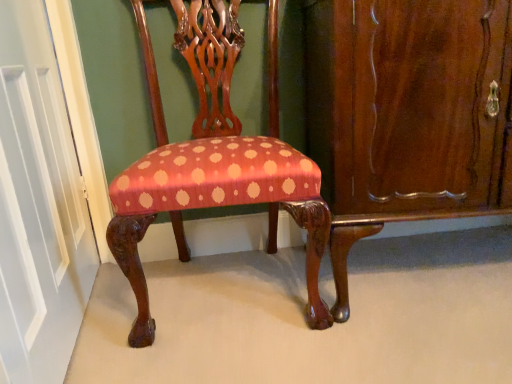
The width and height of the screenshot is (512, 384). What are the coordinates of `free point below mahogany wood dresser at right (from a real-world perspective)` in the screenshot? It's located at (424, 271).